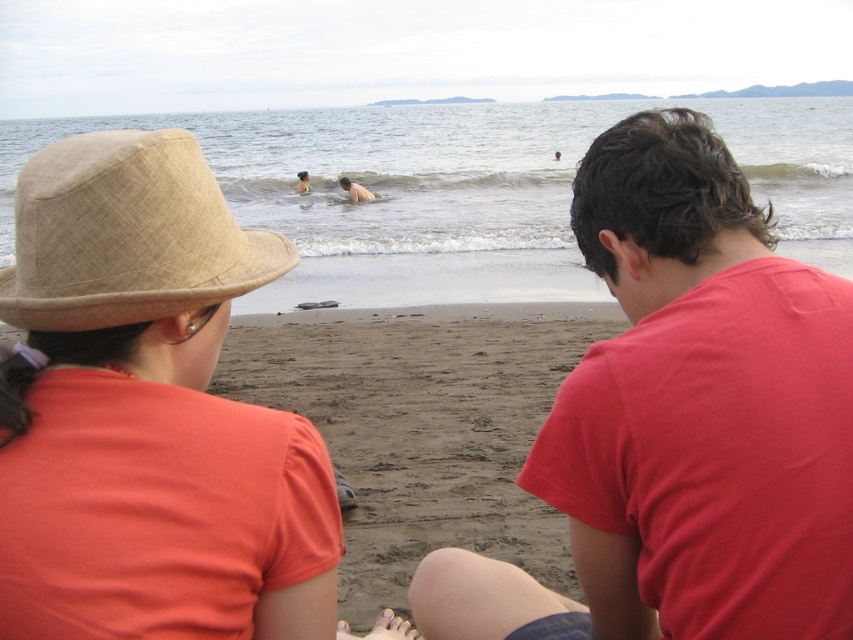
Does matte beige hat at upper left have a greater height compared to naked skin at center?

No.

Which of these two, matte beige hat at upper left or naked skin at center, stands taller?

naked skin at center is taller.

Identify the location of matte beige hat at upper left. (134, 252).

Where is `matte beige hat at upper left`? The width and height of the screenshot is (853, 640). matte beige hat at upper left is located at coordinates (134, 252).

Who is more distant from viewer, (x=328, y=392) or (x=355, y=188)?

The point (x=355, y=188) is behind.

Does brown sandy beach at center appear on the right side of naked skin at center?

Correct, you'll find brown sandy beach at center to the right of naked skin at center.

You are a GUI agent. You are given a task and a screenshot of the screen. Output one action in this format:
    pyautogui.click(x=<x>, y=<y>)
    Task: Click on the brown sandy beach at center
    
    Given the screenshot: What is the action you would take?
    pyautogui.click(x=422, y=426)

Who is higher up, clear water at center or matte beige hat at upper left?

clear water at center is higher up.

Is point (787, 113) farther from viewer compared to point (165, 179)?

Yes, it is behind point (165, 179).

Where is `clear water at center`? clear water at center is located at coordinates (467, 189).